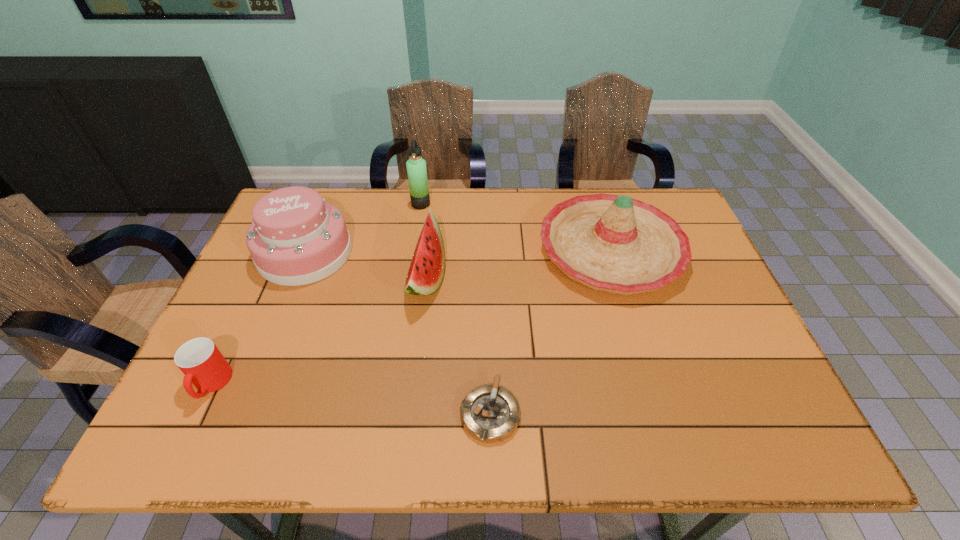
This screenshot has width=960, height=540. Identify the location of object that is positioned at the far left corner. (296, 238).

Image resolution: width=960 pixels, height=540 pixels. Find the location of `object located at the far right corner`. object located at the far right corner is located at coordinates (616, 244).

In the image, there is a desktop. In order to click on blank space at the far edge in this screenshot , I will do `click(516, 227)`.

In the image, there is a desktop. At what (x,y) coordinates should I click in order to perform the action: click on free space at the near edge. Please return your answer as a coordinate pair (x, y). Looking at the image, I should click on (679, 421).

In order to click on free space at the left edge of the desktop in this screenshot , I will do `click(276, 311)`.

Find the location of `free space at the right edge of the desktop`. free space at the right edge of the desktop is located at coordinates (691, 259).

I want to click on vacant space in between the ashtray and the cup, so click(x=350, y=399).

Locate an element on the screen. Image resolution: width=960 pixels, height=540 pixels. free space between the sombrero and the cake is located at coordinates (458, 252).

Where is `vacant area that lies between the second object from right to left and the watermelon`? The width and height of the screenshot is (960, 540). vacant area that lies between the second object from right to left and the watermelon is located at coordinates (458, 346).

What are the coordinates of `vacant space in between the cake and the rightmost object` in the screenshot? It's located at (458, 252).